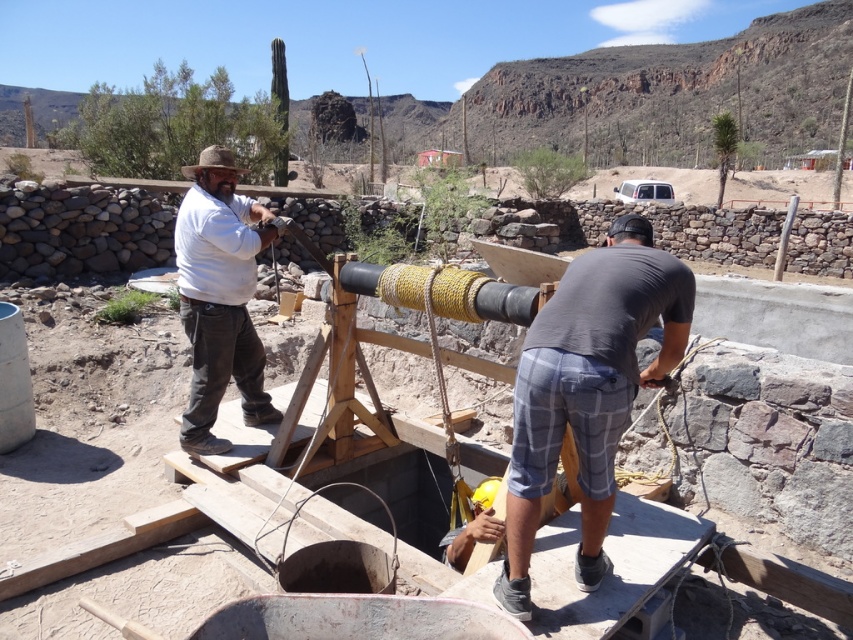
Question: Which point appears farthest from the camera in this image?

Choices:
 (A) (598, 474)
 (B) (218, 440)

Answer: (B)

Question: Can you confirm if gray plaid shorts at center is positioned above wooden frame at center?

Choices:
 (A) yes
 (B) no

Answer: (A)

Question: Does gray plaid shorts at center have a larger size compared to wooden frame at center?

Choices:
 (A) no
 (B) yes

Answer: (A)

Question: Which object is closer to the camera taking this photo?

Choices:
 (A) matte white shirt at center
 (B) gray plaid shorts at center

Answer: (B)

Question: Can you confirm if gray plaid shorts at center is positioned to the left of matte white shirt at center?

Choices:
 (A) no
 (B) yes

Answer: (A)

Question: Estimate the real-world distances between objects in this image. Which object is farther from the matte white shirt at center?

Choices:
 (A) wooden frame at center
 (B) gray plaid shorts at center

Answer: (B)